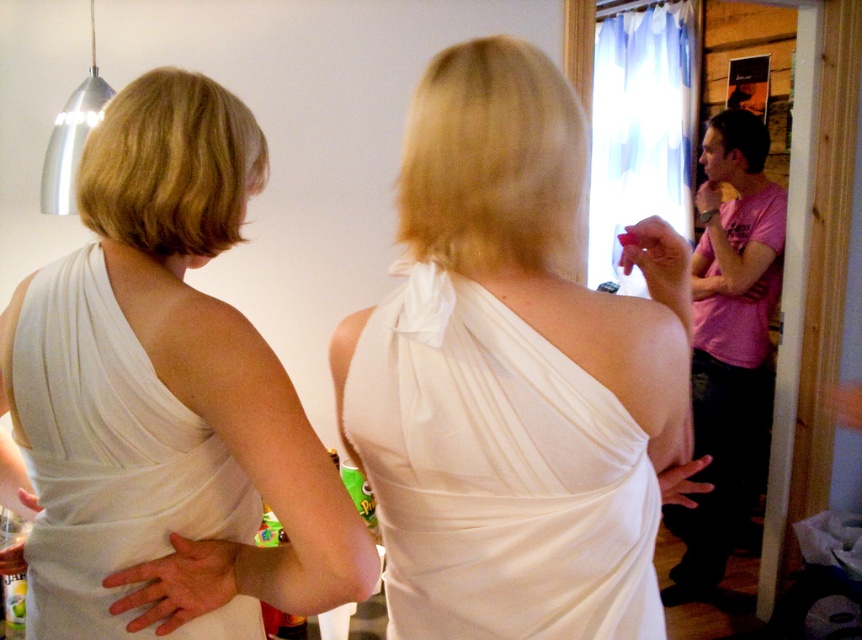
Is white fabric dress at upper left bigger than white fabric dress at back?

Indeed, white fabric dress at upper left has a larger size compared to white fabric dress at back.

Can you confirm if white fabric dress at upper left is taller than white fabric dress at back?

Correct, white fabric dress at upper left is much taller as white fabric dress at back.

The image size is (862, 640). I want to click on white fabric dress at upper left, so click(166, 397).

The height and width of the screenshot is (640, 862). Identify the location of white fabric dress at upper left. (166, 397).

Does white satin dress at center have a lesser width compared to white fabric dress at upper left?

Correct, white satin dress at center's width is less than white fabric dress at upper left's.

Which of these two, white satin dress at center or white fabric dress at upper left, stands shorter?

With less height is white satin dress at center.

In order to click on white satin dress at center in this screenshot , I will do `click(511, 372)`.

Is white satin dress at center above white fabric dress at back?

Correct, white satin dress at center is located above white fabric dress at back.

Does white satin dress at center have a larger size compared to white fabric dress at back?

Yes, white satin dress at center is bigger than white fabric dress at back.

Between point (547, 273) and point (77, 304), which one is positioned in front?

Positioned in front is point (547, 273).

I want to click on white satin dress at center, so click(x=511, y=372).